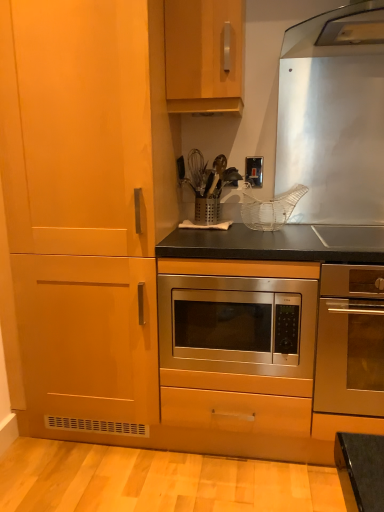
Question: Is satin silver switch at upper center placed right next to stainless steel microwave at center, which is the 2th oven in right-to-left order?

Choices:
 (A) yes
 (B) no

Answer: (B)

Question: Is satin silver switch at upper center positioned with its back to stainless steel microwave at center, marked as the first oven in a left-to-right arrangement?

Choices:
 (A) no
 (B) yes

Answer: (A)

Question: Is satin silver switch at upper center oriented towards stainless steel microwave at center, which is the 2th oven in right-to-left order?

Choices:
 (A) yes
 (B) no

Answer: (B)

Question: Is satin silver switch at upper center taller than stainless steel microwave at center, marked as the first oven in a left-to-right arrangement?

Choices:
 (A) no
 (B) yes

Answer: (A)

Question: Is satin silver switch at upper center not near stainless steel microwave at center, marked as the first oven in a left-to-right arrangement?

Choices:
 (A) yes
 (B) no

Answer: (B)

Question: Based on their positions, is satin silver switch at upper center located to the left or right of stainless steel oven at center, arranged as the second oven when viewed from the left?

Choices:
 (A) right
 (B) left

Answer: (B)

Question: Do you think satin silver switch at upper center is within stainless steel oven at center, arranged as the second oven when viewed from the left, or outside of it?

Choices:
 (A) outside
 (B) inside

Answer: (A)

Question: From a real-world perspective, is satin silver switch at upper center above or below stainless steel oven at center, arranged as the second oven when viewed from the left?

Choices:
 (A) below
 (B) above

Answer: (B)

Question: Considering the positions of point (x=258, y=181) and point (x=360, y=401), is point (x=258, y=181) closer or farther from the camera than point (x=360, y=401)?

Choices:
 (A) farther
 (B) closer

Answer: (A)

Question: From the image's perspective, is satin silver switch at upper center positioned above or below stainless steel microwave at center, marked as the first oven in a left-to-right arrangement?

Choices:
 (A) below
 (B) above

Answer: (B)

Question: From a real-world perspective, is satin silver switch at upper center physically located above or below stainless steel microwave at center, marked as the first oven in a left-to-right arrangement?

Choices:
 (A) below
 (B) above

Answer: (B)

Question: Based on their sizes in the image, would you say satin silver switch at upper center is bigger or smaller than stainless steel microwave at center, which is the 2th oven in right-to-left order?

Choices:
 (A) big
 (B) small

Answer: (B)

Question: Visually, is satin silver switch at upper center positioned to the left or to the right of stainless steel microwave at center, marked as the first oven in a left-to-right arrangement?

Choices:
 (A) right
 (B) left

Answer: (A)

Question: From their relative heights in the image, would you say stainless steel microwave at center, which is the 2th oven in right-to-left order, is taller or shorter than matte wood cabinet at left, the first cabinetry positioned from the left?

Choices:
 (A) tall
 (B) short

Answer: (B)

Question: From a real-world perspective, relative to matte wood cabinet at left, the first cabinetry positioned from the left, is stainless steel microwave at center, which is the 2th oven in right-to-left order, vertically above or below?

Choices:
 (A) below
 (B) above

Answer: (A)